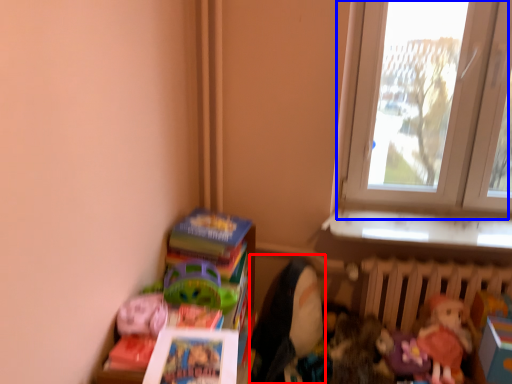
Question: Which object is closer to the camera taking this photo, doll (highlighted by a red box) or window (highlighted by a blue box)?

Choices:
 (A) doll
 (B) window

Answer: (A)